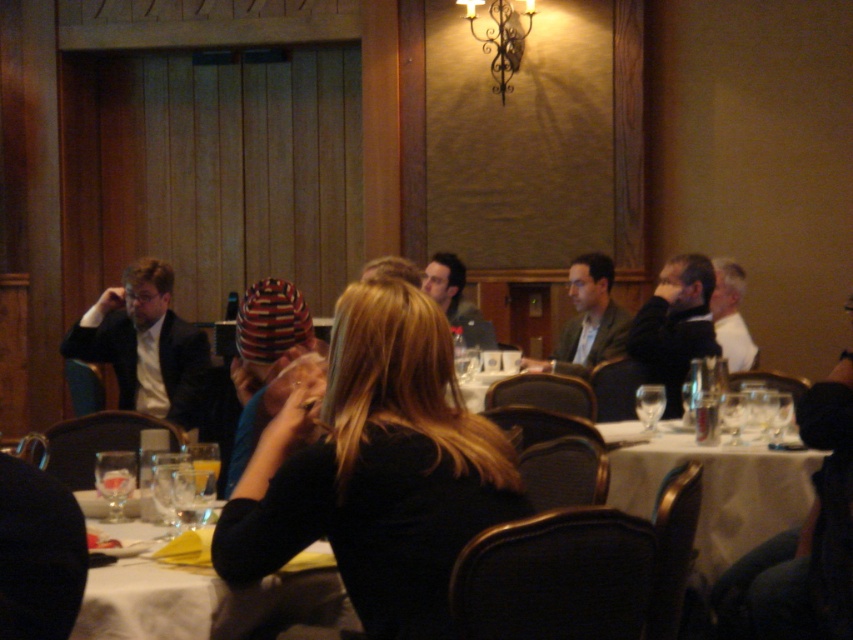
Looking at this image, you are a waiter in a restaurant and need to deliver a drink to a customer. You see a white glossy table at lower left and a matte black laptop at center. Which object should you place the drink on?

The white glossy table at lower left should be used to place the drink because it is located below the matte black laptop at center, indicating it is a table surface appropriate for placing drinks.

You are a server in a restaurant and need to place a new wine glass on the table. There is a matte black laptop at center and a clear glass wine glass at lower left. Where should you place the new wine glass so it doesn not block the laptop?

The new wine glass should be placed away from the matte black laptop at center, possibly near the clear glass wine glass at lower left since the laptop is positioned over the existing wine glass, indicating that area is occupied.

You are a waiter in a formal dining setting. You need to place a dessert plate between the matte black suit at center and the clear glass wine glass at lower left. Which object should you move to make space?

The matte black suit at center is bigger than the clear glass wine glass at lower left, so you should move the matte black suit at center to create enough space for the dessert plate.